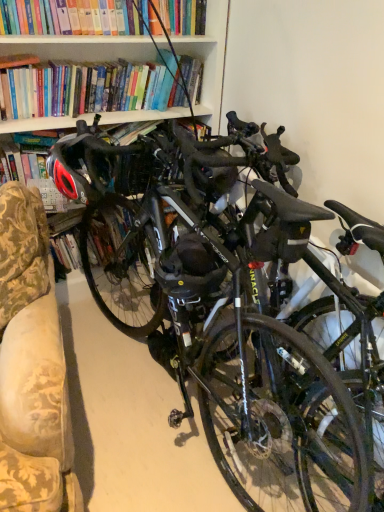
Identify the location of shiny black helmet at left. Image resolution: width=384 pixels, height=512 pixels. (69, 168).

Relative to shiny black bicycle at center, is shiny black helmet at left in front or behind?

shiny black helmet at left is positioned farther from the viewer than shiny black bicycle at center.

Can you tell me how much shiny black helmet at left and shiny black bicycle at center differ in facing direction?

0.00112 degrees.

From the image's perspective, is shiny black helmet at left above shiny black bicycle at center?

Yes, from the image's perspective, shiny black helmet at left is on top of shiny black bicycle at center.

Does shiny black helmet at left touch shiny black bicycle at center?

No, shiny black helmet at left is not next to shiny black bicycle at center.

In terms of width, does shiny black helmet at left look wider or thinner when compared to matte black helmet at center?

Considering their sizes, shiny black helmet at left looks broader than matte black helmet at center.

How different are the orientations of shiny black helmet at left and matte black helmet at center in degrees?

0.00291 degrees separate the facing orientations of shiny black helmet at left and matte black helmet at center.

From a real-world perspective, is shiny black helmet at left below matte black helmet at center?

No, from a real-world perspective, shiny black helmet at left is not beneath matte black helmet at center.

Is shiny black helmet at left bigger than matte black helmet at center?

Indeed, shiny black helmet at left has a larger size compared to matte black helmet at center.

Consider the image. Who is smaller, matte black helmet at center or shiny black helmet at left?

matte black helmet at center.

Is matte black helmet at center touching shiny black helmet at left?

No, matte black helmet at center is not with shiny black helmet at left.

Is point (202, 178) positioned before point (55, 178)?

No.

From the image's perspective, is matte black helmet at center located beneath shiny black bicycle at center?

Incorrect, from the image's perspective, matte black helmet at center is higher than shiny black bicycle at center.

Is matte black helmet at center directly adjacent to shiny black bicycle at center?

matte black helmet at center is not next to shiny black bicycle at center, and they're not touching.

This screenshot has width=384, height=512. What are the coordinates of `helmet above the shiny black bicycle at center (from a real-world perspective)` in the screenshot? It's located at (210, 173).

Identify the location of bicycle below the shiny black helmet at left (from the image's perspective). (236, 315).

Is shiny black bicycle at center closer to camera compared to shiny black helmet at left?

Yes, shiny black bicycle at center is in front of shiny black helmet at left.

From a real-world perspective, between shiny black bicycle at center and shiny black helmet at left, who is vertically lower?

From a 3D spatial view, shiny black bicycle at center is below.

Considering the sizes of shiny black bicycle at center and shiny black helmet at left in the image, is shiny black bicycle at center wider or thinner than shiny black helmet at left?

shiny black bicycle at center is wider than shiny black helmet at left.

Which object is closer to the camera, shiny black bicycle at center or matte black helmet at center?

Positioned in front is shiny black bicycle at center.

From a real-world perspective, is shiny black bicycle at center on matte black helmet at center?

Actually, shiny black bicycle at center is physically below matte black helmet at center in the real world.

Can we say shiny black bicycle at center lies outside matte black helmet at center?

That's correct, shiny black bicycle at center is outside of matte black helmet at center.

I want to click on bicycle helmet located above the shiny black bicycle at center (from the image's perspective), so tap(69, 168).

In order to click on helmet on the right of shiny black helmet at left in this screenshot , I will do `click(210, 173)`.

Which object lies further to the anchor point matte black helmet at center, shiny black bicycle at center or shiny black helmet at left?

shiny black bicycle at center is positioned further to the anchor matte black helmet at center.

Considering their positions, is shiny black helmet at left positioned closer to shiny black bicycle at center than matte black helmet at center?

matte black helmet at center.

Estimate the real-world distances between objects in this image. Which object is closer to shiny black helmet at left, shiny black bicycle at center or matte black helmet at center?

Among the two, matte black helmet at center is located nearer to shiny black helmet at left.

Estimate the real-world distances between objects in this image. Which object is further from shiny black bicycle at center, matte black helmet at center or shiny black helmet at left?

shiny black helmet at left is further to shiny black bicycle at center.

Estimate the real-world distances between objects in this image. Which object is further from shiny black helmet at left, matte black helmet at center or shiny black bicycle at center?

shiny black bicycle at center.

Which object lies nearer to the anchor point matte black helmet at center, shiny black helmet at left or shiny black bicycle at center?

shiny black helmet at left.

Locate an element on the screen. bicycle helmet positioned between shiny black bicycle at center and matte black helmet at center from near to far is located at coordinates (69, 168).